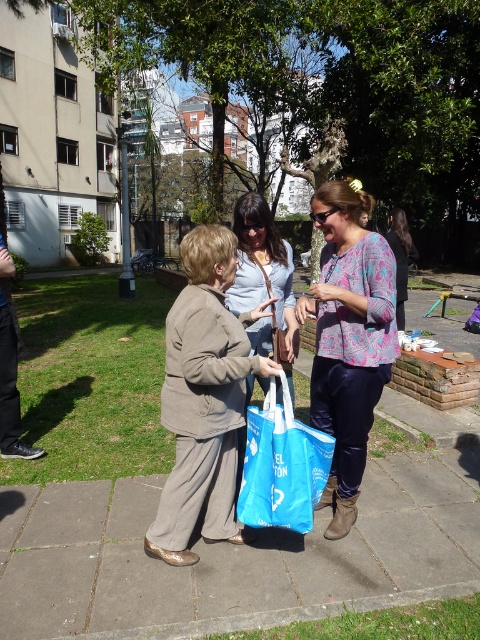
Question: Which point appears closest to the camera in this image?

Choices:
 (A) (475, 492)
 (B) (238, 364)
 (C) (411, 248)

Answer: (B)

Question: Does matte brown jacket at center have a smaller size compared to blue fabric bag at center?

Choices:
 (A) yes
 (B) no

Answer: (B)

Question: Is floral print blouse at center to the left of light blue cotton shirt at center from the viewer's perspective?

Choices:
 (A) no
 (B) yes

Answer: (A)

Question: Is matte brown jacket at center to the left of blue fabric bag at center from the viewer's perspective?

Choices:
 (A) no
 (B) yes

Answer: (B)

Question: Estimate the real-world distances between objects in this image. Which object is closer to the patterned fabric shirt at center?

Choices:
 (A) smooth concrete pavement at center
 (B) matte brown jacket at center

Answer: (A)

Question: Which point is farther to the camera?

Choices:
 (A) click(276, 460)
 (B) click(286, 532)
 (C) click(240, 221)

Answer: (C)